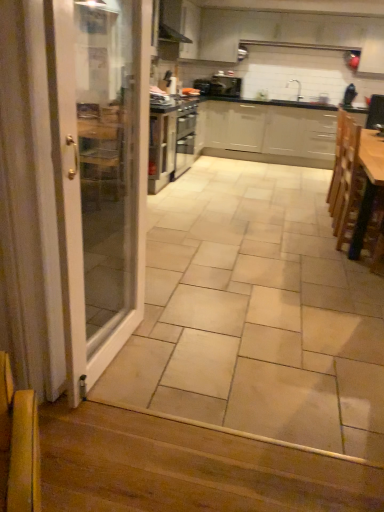
Question: Can you confirm if beige ceramic tile at center is thinner than wooden table at right?

Choices:
 (A) no
 (B) yes

Answer: (A)

Question: Is beige ceramic tile at center at the left side of wooden table at right?

Choices:
 (A) no
 (B) yes

Answer: (B)

Question: Is beige ceramic tile at center far from wooden table at right?

Choices:
 (A) no
 (B) yes

Answer: (A)

Question: Is beige ceramic tile at center taller than wooden table at right?

Choices:
 (A) no
 (B) yes

Answer: (A)

Question: Is beige ceramic tile at center wider than wooden table at right?

Choices:
 (A) no
 (B) yes

Answer: (B)

Question: Would you say beige ceramic tile at center is outside wooden table at right?

Choices:
 (A) no
 (B) yes

Answer: (B)

Question: Is wooden at lower left taller than black matte exhaust hood at upper center?

Choices:
 (A) no
 (B) yes

Answer: (A)

Question: Is wooden at lower left at the left side of black matte exhaust hood at upper center?

Choices:
 (A) yes
 (B) no

Answer: (B)

Question: From the image's perspective, is wooden at lower left beneath black matte exhaust hood at upper center?

Choices:
 (A) no
 (B) yes

Answer: (B)

Question: Considering the relative sizes of wooden at lower left and black matte exhaust hood at upper center in the image provided, is wooden at lower left thinner than black matte exhaust hood at upper center?

Choices:
 (A) no
 (B) yes

Answer: (A)

Question: From a real-world perspective, is wooden at lower left positioned under black matte exhaust hood at upper center based on gravity?

Choices:
 (A) no
 (B) yes

Answer: (B)

Question: Is wooden at lower left in front of black matte exhaust hood at upper center?

Choices:
 (A) no
 (B) yes

Answer: (B)

Question: Can you confirm if black matte exhaust hood at upper center is positioned to the right of wooden at lower left?

Choices:
 (A) yes
 (B) no

Answer: (B)